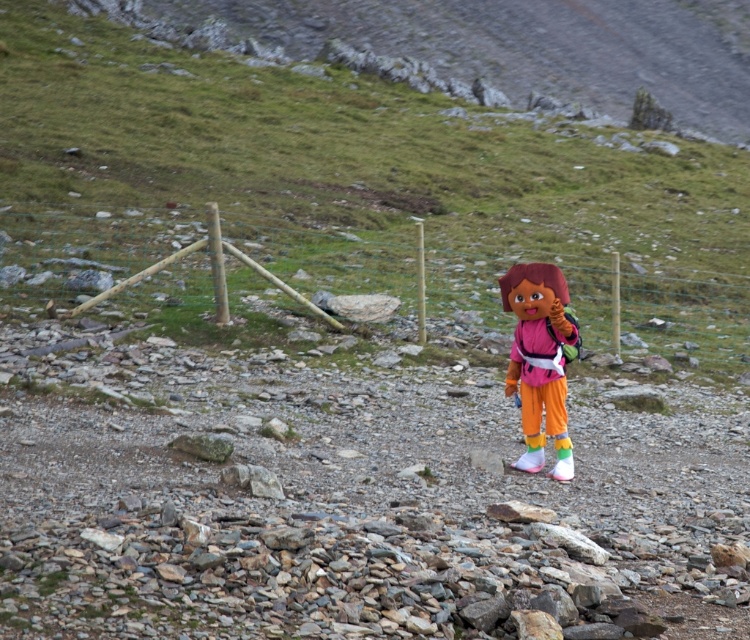
Question: From the image, what is the correct spatial relationship of green grassy hillside at center in relation to matte pink plush doll at center?

Choices:
 (A) right
 (B) left

Answer: (A)

Question: Does green grassy hillside at center have a smaller size compared to matte pink plush doll at center?

Choices:
 (A) yes
 (B) no

Answer: (B)

Question: Which point appears farthest from the camera in this image?

Choices:
 (A) (106, 120)
 (B) (555, 410)

Answer: (A)

Question: Does green grassy hillside at center have a larger size compared to matte pink plush doll at center?

Choices:
 (A) no
 (B) yes

Answer: (B)